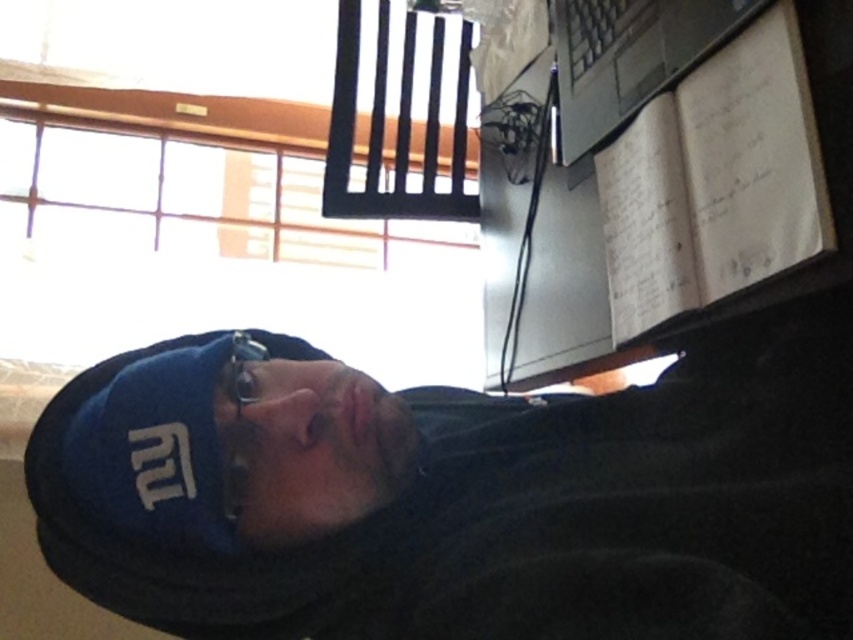
Between black plastic laptop at upper right and metallic reflective glasses at center, which one appears on the right side from the viewer's perspective?

Positioned to the right is black plastic laptop at upper right.

Between point (581, 124) and point (236, 420), which one is positioned in front?

Point (236, 420) is in front.

At what (x,y) coordinates should I click in order to perform the action: click on black plastic laptop at upper right. Please return your answer as a coordinate pair (x, y). The height and width of the screenshot is (640, 853). Looking at the image, I should click on click(x=630, y=58).

Between blue fabric cap at upper left and metallic reflective glasses at center, which one has more height?

Standing taller between the two is blue fabric cap at upper left.

Between blue fabric cap at upper left and metallic reflective glasses at center, which one is positioned higher?

Positioned higher is metallic reflective glasses at center.

Which is in front, point (105, 394) or point (231, 518)?

Point (231, 518)

At what (x,y) coordinates should I click in order to perform the action: click on blue fabric cap at upper left. Please return your answer as a coordinate pair (x, y). This screenshot has width=853, height=640. Looking at the image, I should click on (460, 497).

Is blue fabric cap at upper left below black plastic laptop at upper right?

Yes.

Describe the element at coordinates (460, 497) in the screenshot. The image size is (853, 640). I see `blue fabric cap at upper left` at that location.

Does point (589, 580) come closer to viewer compared to point (561, 115)?

Yes, it is in front of point (561, 115).

What are the coordinates of `blue fabric cap at upper left` in the screenshot? It's located at (460, 497).